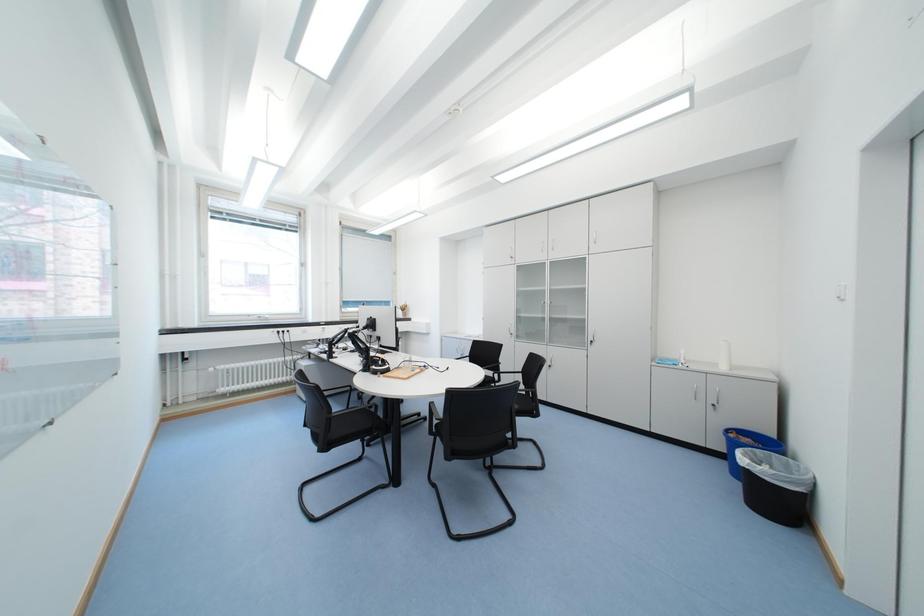
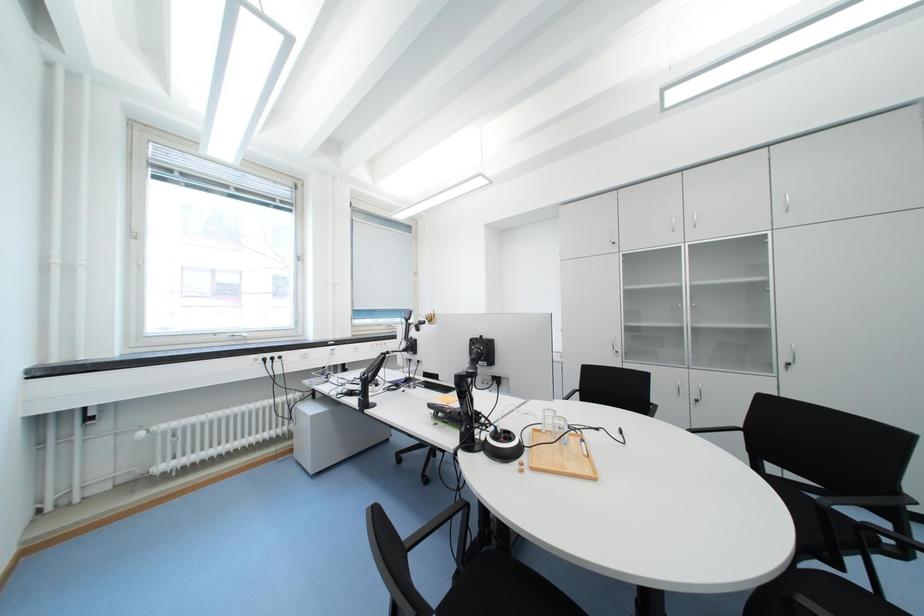
Which direction would the cameraman need to move to produce the second image?

The movement direction of the cameraman is left, forward.